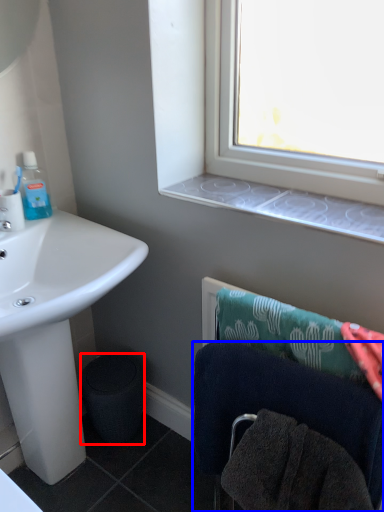
Question: Among these objects, which one is farthest to the camera, trash bin/can (highlighted by a red box) or towel (highlighted by a blue box)?

Choices:
 (A) trash bin/can
 (B) towel

Answer: (A)